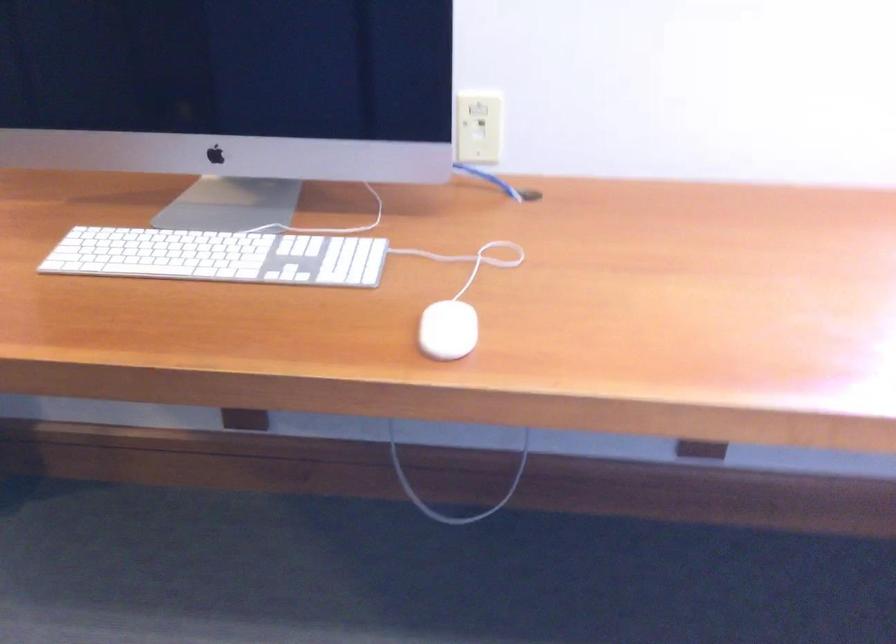
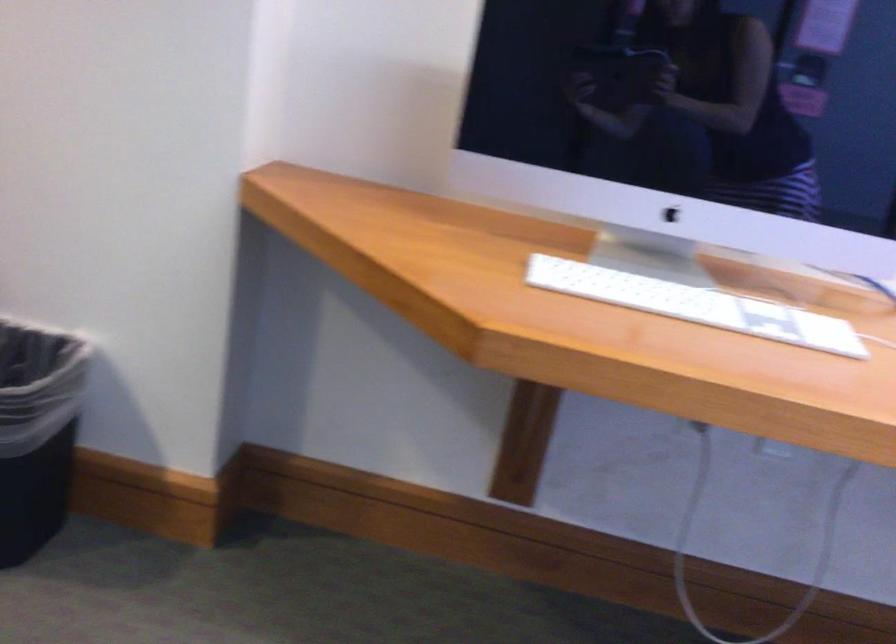
Find the pixel in the second image that matches pixel 228 260 in the first image.

(695, 305)